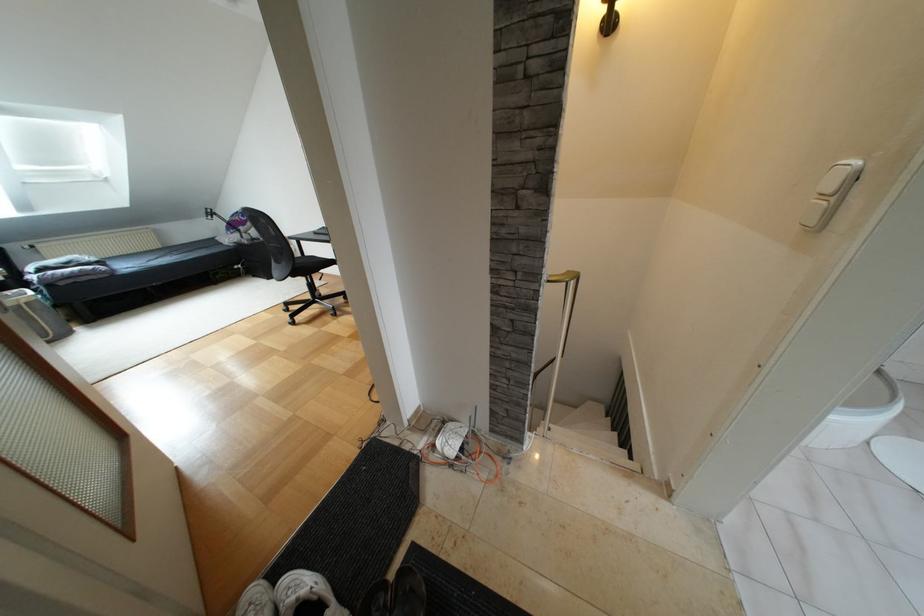
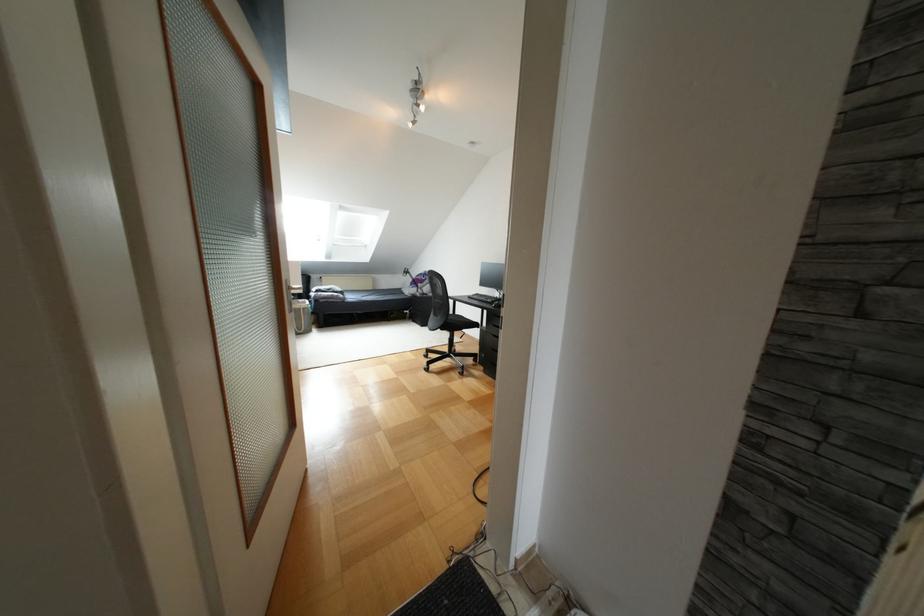
The point at (293,275) is marked in the first image. Where is the corresponding point in the second image?

(442, 328)